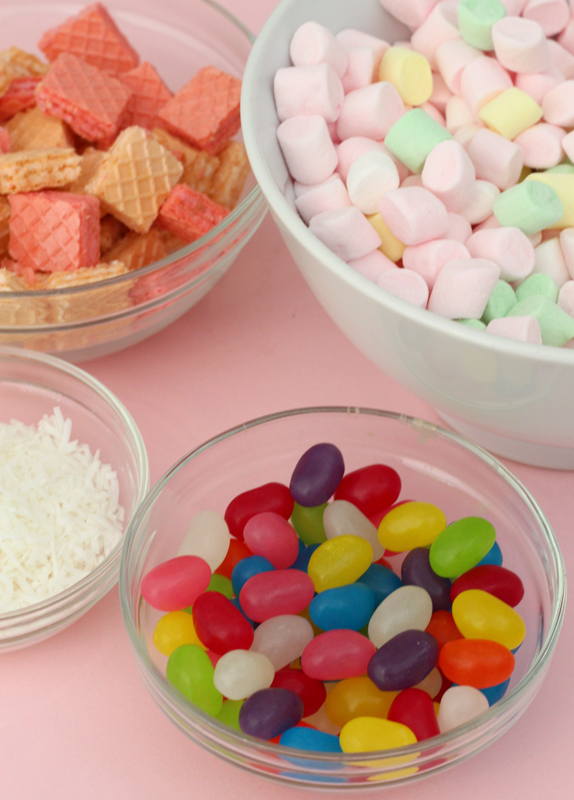
The height and width of the screenshot is (800, 574). Find the location of `clear bowl`. clear bowl is located at coordinates (452, 470), (124, 434), (145, 297).